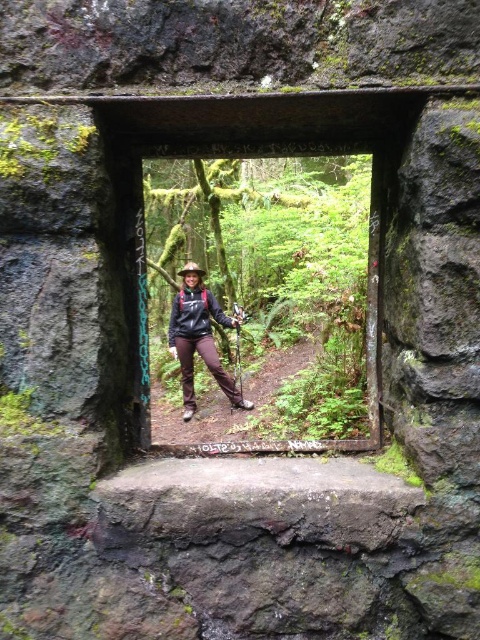
Can you confirm if transparent glass window at center is positioned to the left of matte black jacket at center?

A: No, transparent glass window at center is not to the left of matte black jacket at center.

The height and width of the screenshot is (640, 480). Describe the element at coordinates (267, 304) in the screenshot. I see `transparent glass window at center` at that location.

Who is more forward, (339, 170) or (191, 410)?

Positioned in front is point (191, 410).

Locate an element on the screen. This screenshot has width=480, height=640. transparent glass window at center is located at coordinates (267, 304).